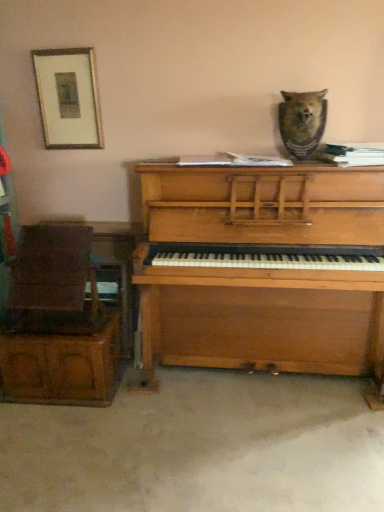
Question: Considering their positions, is wooden chair at left located in front of or behind brown fur bear at upper center?

Choices:
 (A) front
 (B) behind

Answer: (B)

Question: Based on their sizes in the image, would you say wooden chair at left is bigger or smaller than brown fur bear at upper center?

Choices:
 (A) small
 (B) big

Answer: (B)

Question: Estimate the real-world distances between objects in this image. Which object is closer to the wooden picture frame at upper left?

Choices:
 (A) wooden piano at center
 (B) brown fur bear at upper center
 (C) wooden chair at left
 (D) wooden chair at left

Answer: (C)

Question: Which of these objects is positioned closest to the wooden picture frame at upper left?

Choices:
 (A) wooden piano at center
 (B) wooden chair at left
 (C) brown fur bear at upper center
 (D) wooden chair at left

Answer: (B)